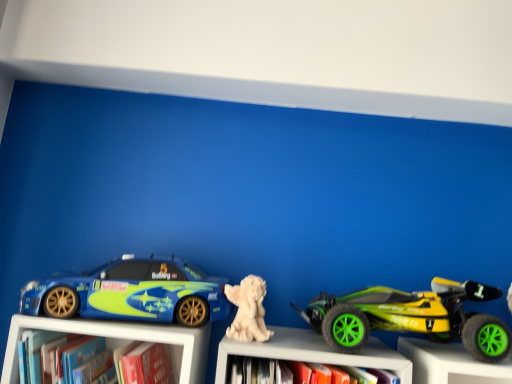
Question: Is white matte statue at center at the back of white matte statue at center, which appears as the 1th toy when viewed from the left?

Choices:
 (A) no
 (B) yes

Answer: (A)

Question: Considering the relative sizes of white matte statue at center, the 2th toy when ordered from right to left, and white matte statue at center in the image provided, is white matte statue at center, the 2th toy when ordered from right to left, taller than white matte statue at center?

Choices:
 (A) no
 (B) yes

Answer: (A)

Question: From the image's perspective, would you say white matte statue at center, the 2th toy when ordered from right to left, is positioned over white matte statue at center?

Choices:
 (A) yes
 (B) no

Answer: (A)

Question: Does white matte statue at center, the 2th toy when ordered from right to left, come in front of white matte statue at center?

Choices:
 (A) yes
 (B) no

Answer: (B)

Question: From a real-world perspective, does white matte statue at center, the 2th toy when ordered from right to left, sit lower than white matte statue at center?

Choices:
 (A) no
 (B) yes

Answer: (A)

Question: Does white matte statue at center, which appears as the 1th toy when viewed from the left, have a lesser height compared to white matte statue at center?

Choices:
 (A) yes
 (B) no

Answer: (A)

Question: Is hardcover book at lower left taller than green rubber toy car at right, positioned as the 1th toy in right-to-left order?

Choices:
 (A) no
 (B) yes

Answer: (A)

Question: Is hardcover book at lower left closer to camera compared to green rubber toy car at right, the 2th toy from the left?

Choices:
 (A) no
 (B) yes

Answer: (B)

Question: Considering the relative positions of hardcover book at lower left and green rubber toy car at right, positioned as the 1th toy in right-to-left order, in the image provided, is hardcover book at lower left to the left of green rubber toy car at right, positioned as the 1th toy in right-to-left order, from the viewer's perspective?

Choices:
 (A) yes
 (B) no

Answer: (A)

Question: Does hardcover book at lower left have a lesser height compared to green rubber toy car at right, positioned as the 1th toy in right-to-left order?

Choices:
 (A) yes
 (B) no

Answer: (A)

Question: Can you confirm if hardcover book at lower left is smaller than green rubber toy car at right, positioned as the 1th toy in right-to-left order?

Choices:
 (A) no
 (B) yes

Answer: (B)

Question: From a real-world perspective, is hardcover book at lower left below green rubber toy car at right, the 2th toy from the left?

Choices:
 (A) yes
 (B) no

Answer: (A)

Question: From the image's perspective, is white matte statue at center located above hardcover book at lower left?

Choices:
 (A) no
 (B) yes

Answer: (A)